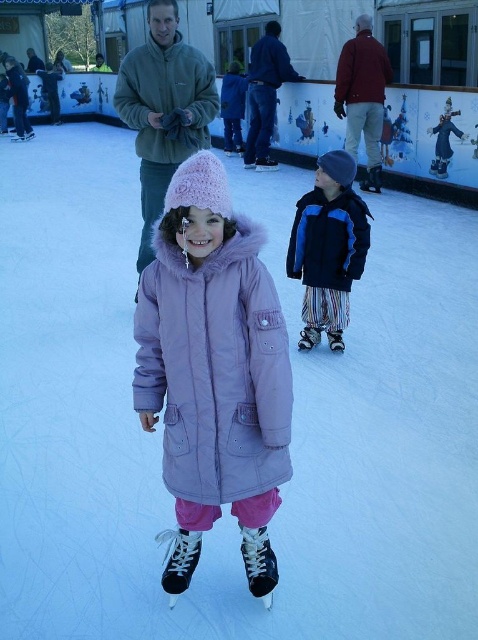
Question: Which point is closer to the camera taking this photo?

Choices:
 (A) (133, 106)
 (B) (354, 92)
 (C) (150, 124)
 (D) (264, 157)

Answer: (C)

Question: Is green fleece jacket at upper center above dark blue jacket at center?

Choices:
 (A) no
 (B) yes

Answer: (A)

Question: Among these points, which one is farthest from the camera?

Choices:
 (A) pos(145,333)
 (B) pos(336,83)
 (C) pos(370,76)

Answer: (B)

Question: Is gray fleece jacket at upper center positioned behind matte red jacket at upper center?

Choices:
 (A) yes
 (B) no

Answer: (B)

Question: Among these points, which one is farthest from the camera?

Choices:
 (A) (194, 92)
 (B) (143, 108)
 (C) (377, 124)
 (D) (197, 486)

Answer: (C)

Question: Does gray fleece jacket at upper center have a lesser width compared to dark blue jacket at center?

Choices:
 (A) no
 (B) yes

Answer: (B)